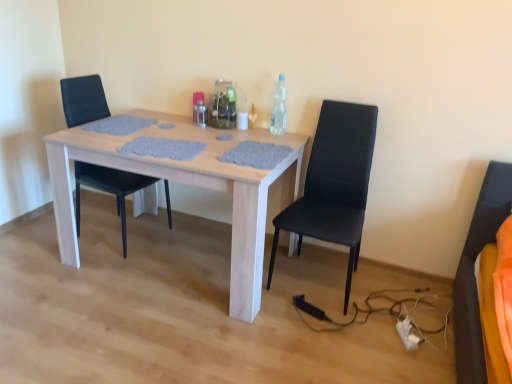
Find the location of a particular element. Image resolution: width=512 pixels, height=384 pixels. free space to the left of clear plastic bottle at upper right, arranged as the third bottle when viewed from the left is located at coordinates (254, 133).